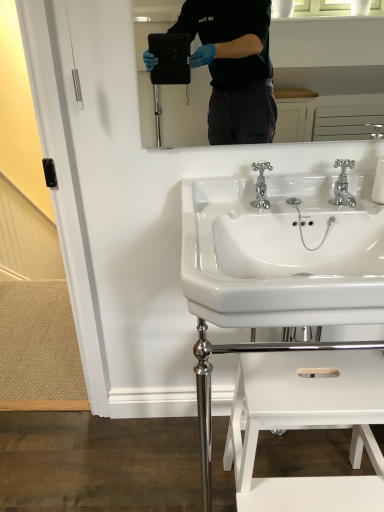
Question: Should I look upward or downward to see white glossy sink at center, the first sink when ordered from bottom to top?

Choices:
 (A) down
 (B) up

Answer: (A)

Question: Is there a large distance between white glossy sink at center, the first sink when ordered from bottom to top, and white glossy step stool at lower center?

Choices:
 (A) yes
 (B) no

Answer: (B)

Question: Is white glossy sink at center, arranged as the 2th sink when viewed from the top, further to the viewer compared to white glossy step stool at lower center?

Choices:
 (A) no
 (B) yes

Answer: (B)

Question: Is white glossy step stool at lower center a part of white glossy sink at center, arranged as the 2th sink when viewed from the top?

Choices:
 (A) no
 (B) yes

Answer: (B)

Question: From a real-world perspective, is white glossy sink at center, arranged as the 2th sink when viewed from the top, under white glossy step stool at lower center?

Choices:
 (A) no
 (B) yes

Answer: (A)

Question: From the image's perspective, is white glossy sink at center, the first sink when ordered from bottom to top, beneath white glossy step stool at lower center?

Choices:
 (A) no
 (B) yes

Answer: (A)

Question: Is white glossy sink at center, arranged as the 2th sink when viewed from the top, outside white glossy step stool at lower center?

Choices:
 (A) no
 (B) yes

Answer: (B)

Question: Is white glossy sink at center, the first sink when ordered from bottom to top, aimed at chrome metallic faucet at center, which is the 1th tap from left to right?

Choices:
 (A) no
 (B) yes

Answer: (A)

Question: Is the position of white glossy sink at center, arranged as the 2th sink when viewed from the top, less distant than that of chrome metallic faucet at center, the second tap when ordered from right to left?

Choices:
 (A) yes
 (B) no

Answer: (A)

Question: Does white glossy sink at center, arranged as the 2th sink when viewed from the top, have a greater height compared to chrome metallic faucet at center, the second tap when ordered from right to left?

Choices:
 (A) yes
 (B) no

Answer: (A)

Question: Can you confirm if white glossy sink at center, arranged as the 2th sink when viewed from the top, is wider than chrome metallic faucet at center, the second tap when ordered from right to left?

Choices:
 (A) no
 (B) yes

Answer: (B)

Question: Is white glossy sink at center, the first sink when ordered from bottom to top, completely or partially outside of chrome metallic faucet at center, the second tap when ordered from right to left?

Choices:
 (A) no
 (B) yes

Answer: (B)

Question: Considering the relative positions of white glossy sink at center, the first sink when ordered from bottom to top, and chrome metallic faucet at center, which is the 1th tap from left to right, in the image provided, is white glossy sink at center, the first sink when ordered from bottom to top, to the left of chrome metallic faucet at center, which is the 1th tap from left to right, from the viewer's perspective?

Choices:
 (A) yes
 (B) no

Answer: (B)

Question: From a real-world perspective, does white glossy step stool at lower center stand above white glossy sink at center, acting as the 2th sink starting from the bottom?

Choices:
 (A) yes
 (B) no

Answer: (B)